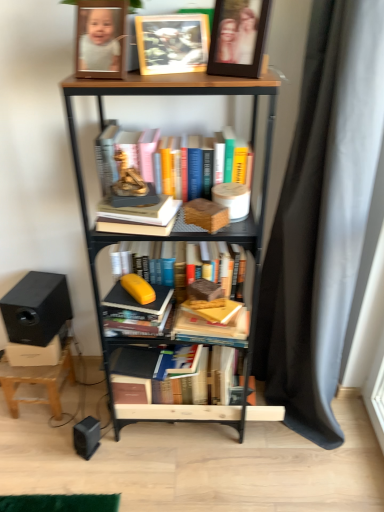
Identify the location of vacant space situated on the left part of black fabric curtain at right. This screenshot has height=512, width=384. (227, 459).